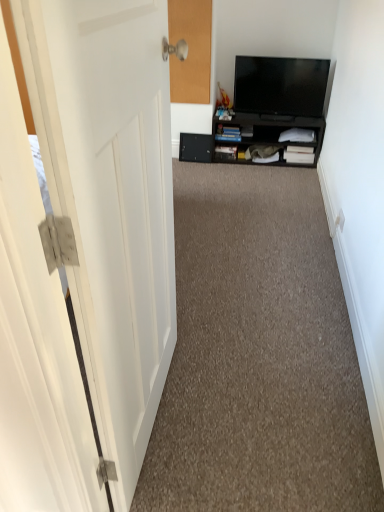
Question: Does black matte cabinet at center lie behind black glossy tv at upper right?

Choices:
 (A) yes
 (B) no

Answer: (A)

Question: Is black matte cabinet at center shorter than black glossy tv at upper right?

Choices:
 (A) yes
 (B) no

Answer: (A)

Question: Is black matte cabinet at center positioned before black glossy tv at upper right?

Choices:
 (A) yes
 (B) no

Answer: (B)

Question: Can you confirm if black matte cabinet at center is smaller than black glossy tv at upper right?

Choices:
 (A) yes
 (B) no

Answer: (B)

Question: Is black matte cabinet at center taller than black glossy tv at upper right?

Choices:
 (A) yes
 (B) no

Answer: (B)

Question: From a real-world perspective, is black matte cabinet at center positioned over black glossy tv at upper right based on gravity?

Choices:
 (A) no
 (B) yes

Answer: (A)

Question: Can you confirm if black matte cabinet at center is positioned to the left of carpet at center?

Choices:
 (A) no
 (B) yes

Answer: (A)

Question: From the image's perspective, is black matte cabinet at center over carpet at center?

Choices:
 (A) yes
 (B) no

Answer: (A)

Question: Is black matte cabinet at center far away from carpet at center?

Choices:
 (A) no
 (B) yes

Answer: (B)

Question: Is black matte cabinet at center oriented towards carpet at center?

Choices:
 (A) no
 (B) yes

Answer: (B)

Question: Is black matte cabinet at center positioned with its back to carpet at center?

Choices:
 (A) yes
 (B) no

Answer: (B)

Question: Does black matte cabinet at center have a greater height compared to carpet at center?

Choices:
 (A) yes
 (B) no

Answer: (A)

Question: Is the depth of black glossy tv at upper right less than that of black matte drawer at center?

Choices:
 (A) no
 (B) yes

Answer: (B)